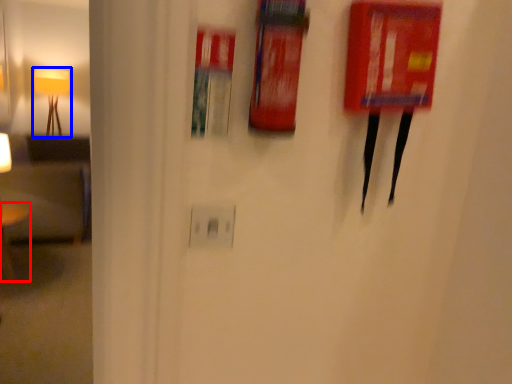
Question: Which object appears farthest to the camera in this image, furniture (highlighted by a red box) or lamp (highlighted by a blue box)?

Choices:
 (A) furniture
 (B) lamp

Answer: (B)